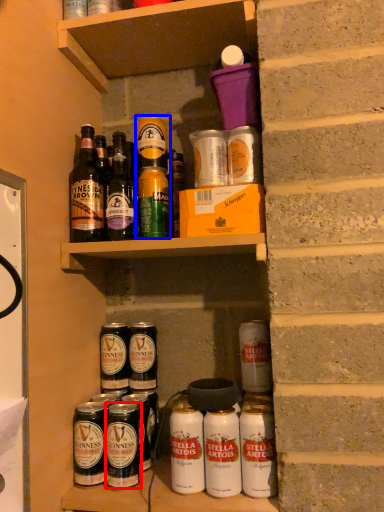
Question: Which point is further to the camera, beverage (highlighted by a red box) or yoghurt (highlighted by a blue box)?

Choices:
 (A) beverage
 (B) yoghurt

Answer: (B)